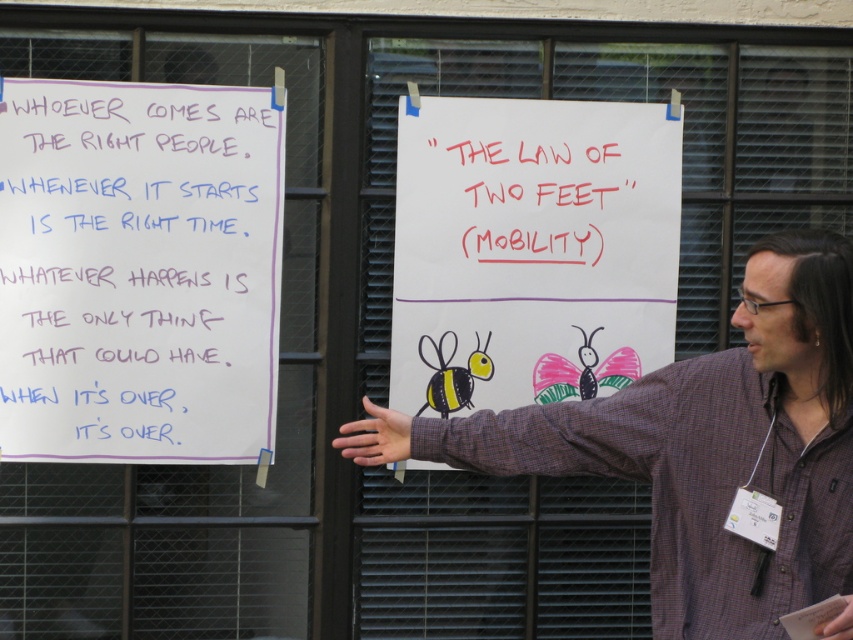
You are an office worker who needs to present a project. You notice the red marker text at upper center and the yellow matte bee at center on the whiteboard. Which object is larger in size?

The red marker text at upper center is bigger than the yellow matte bee at center.

What is the position of the red marker text at upper center relative to the other objects in the scene?

The red marker text at upper center is located at point coordinates (535, 202).